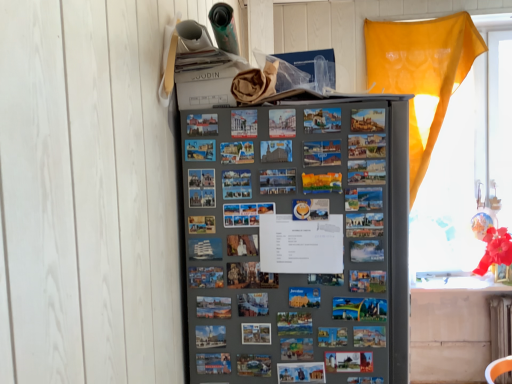
Question: Considering the positions of point (441, 215) and point (505, 297), is point (441, 215) closer or farther from the camera than point (505, 297)?

Choices:
 (A) farther
 (B) closer

Answer: (A)

Question: Considering the positions of translucent yellow curtain at right and white painted metal radiator at lower right in the image, is translucent yellow curtain at right taller or shorter than white painted metal radiator at lower right?

Choices:
 (A) tall
 (B) short

Answer: (A)

Question: Which of these objects is positioned closest to the white painted metal radiator at lower right?

Choices:
 (A) translucent yellow curtain at right
 (B) metallic gray refrigerator at center

Answer: (A)

Question: Which of these objects is positioned farthest from the translucent yellow curtain at right?

Choices:
 (A) metallic gray refrigerator at center
 (B) white painted metal radiator at lower right

Answer: (A)